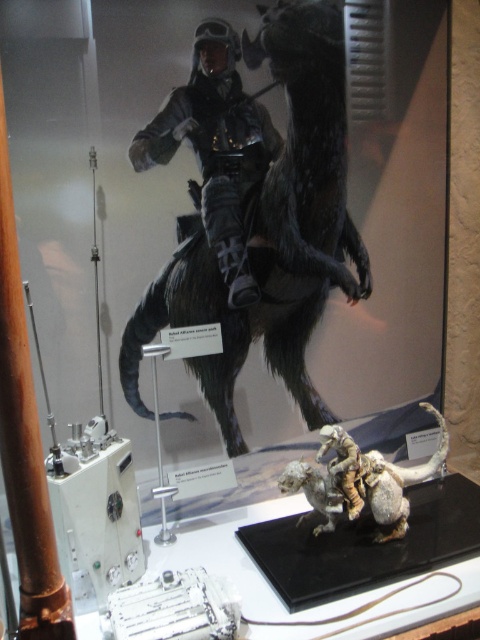
Between furry black horse at center and white matte dinosaur at lower center, which one is positioned higher?

Positioned higher is furry black horse at center.

Consider the image. Is furry black horse at center positioned at the back of white matte dinosaur at lower center?

That is True.

Who is more forward, (313, 72) or (372, 468)?

Point (372, 468) is more forward.

This screenshot has height=640, width=480. Find the location of `furry black horse at center`. furry black horse at center is located at coordinates [x=271, y=234].

Who is more distant from viewer, (x=250, y=129) or (x=398, y=499)?

The point (x=250, y=129) is more distant.

In the scene shown: Does shiny silver spacesuit at upper center have a smaller size compared to white matte dinosaur at lower center?

Indeed, shiny silver spacesuit at upper center has a smaller size compared to white matte dinosaur at lower center.

Does point (204, 202) lie in front of point (442, 433)?

Yes, point (204, 202) is in front of point (442, 433).

Identify the location of shiny silver spacesuit at upper center. (216, 147).

Does furry black horse at center have a larger size compared to shiny silver spacesuit at upper center?

Yes, furry black horse at center is bigger than shiny silver spacesuit at upper center.

Which is behind, point (337, 264) or point (238, 134)?

Positioned behind is point (337, 264).

Identify the location of furry black horse at center. This screenshot has height=640, width=480. (271, 234).